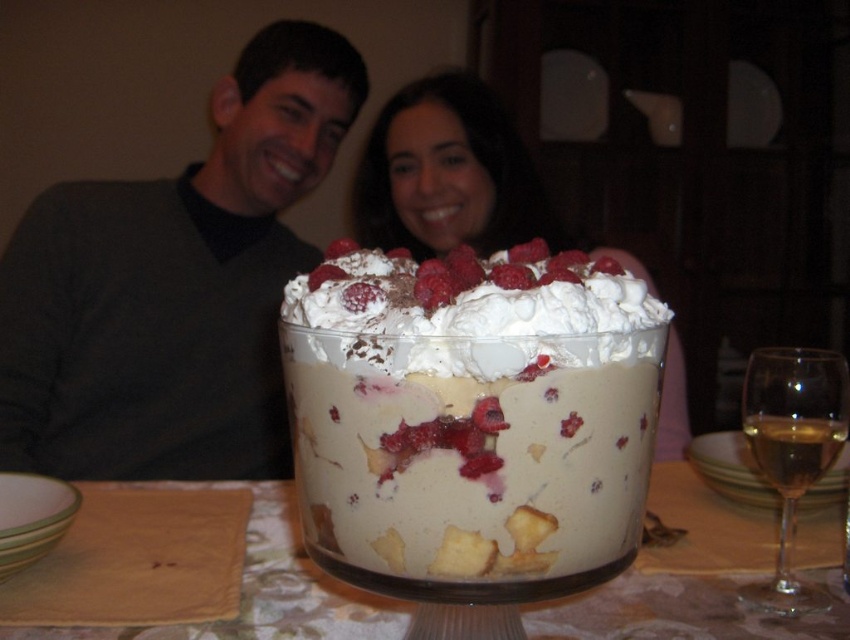
Question: Is dark gray sweater at center closer to the viewer compared to white creamy pudding at center?

Choices:
 (A) yes
 (B) no

Answer: (B)

Question: Which object appears farthest from the camera in this image?

Choices:
 (A) dark gray sweater at center
 (B) green glazed bowl at lower left

Answer: (A)

Question: Which point is farther to the camera?

Choices:
 (A) translucent glass wine at right
 (B) white creamy pudding at center

Answer: (A)

Question: Which object is farther from the camera taking this photo?

Choices:
 (A) translucent glass trifle at center
 (B) green glazed bowl at lower left
 (C) smooth skin face at center

Answer: (C)

Question: Can you confirm if smooth skin face at center is positioned to the right of green glazed bowl at lower left?

Choices:
 (A) no
 (B) yes

Answer: (B)

Question: Does white creamy pudding at center have a lesser width compared to translucent glass wine at right?

Choices:
 (A) no
 (B) yes

Answer: (A)